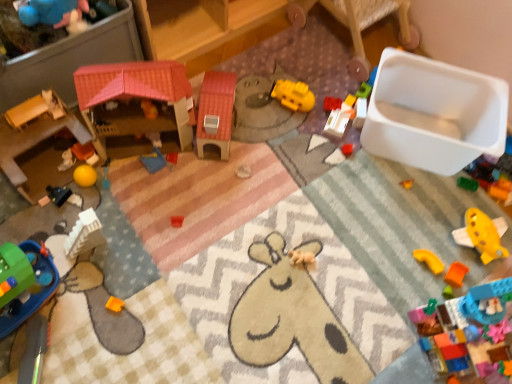
Find the location of `free space that is in between plastic pink house at center, the 7th toy in the left-to-right sequence, and translucent blue plastic blocks at lower right, the third toy viewed from the right`. free space that is in between plastic pink house at center, the 7th toy in the left-to-right sequence, and translucent blue plastic blocks at lower right, the third toy viewed from the right is located at coordinates (296, 230).